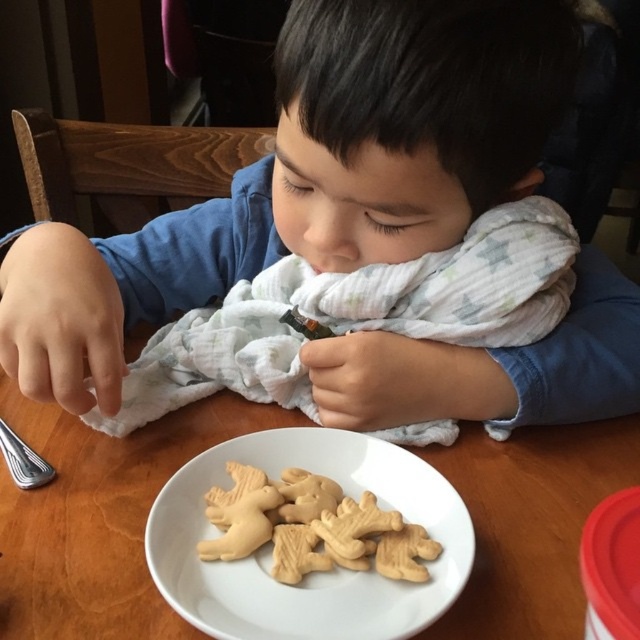
Question: Can you confirm if wooden table at center is bigger than silver metallic fork at lower left?

Choices:
 (A) yes
 (B) no

Answer: (A)

Question: Which point is closer to the camera?

Choices:
 (A) click(x=452, y=397)
 (B) click(x=176, y=616)
 (C) click(x=291, y=616)
 (D) click(x=0, y=433)

Answer: (C)

Question: Is matte white scarf at lower center wider than golden-brown biscuit at lower center?

Choices:
 (A) yes
 (B) no

Answer: (A)

Question: Which object is closer to the camera taking this photo?

Choices:
 (A) wooden table at center
 (B) silver metallic fork at lower left
 (C) white matte plate at lower center

Answer: (C)

Question: Is matte white scarf at lower center positioned at the back of silver metallic fork at lower left?

Choices:
 (A) no
 (B) yes

Answer: (A)

Question: Among these points, which one is farthest from the camera?

Choices:
 (A) (321, 628)
 (B) (13, 456)

Answer: (B)